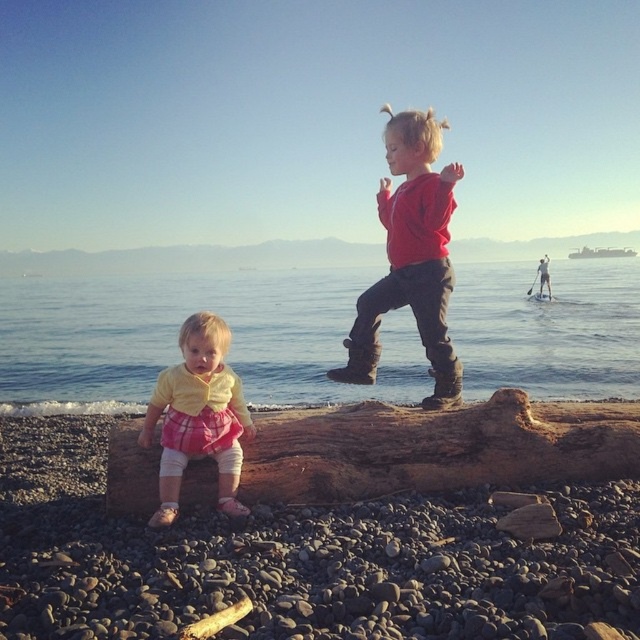
Question: Which of the following is the farthest from the observer?

Choices:
 (A) (538, 269)
 (B) (200, 344)

Answer: (A)

Question: Which object appears closest to the camera in this image?

Choices:
 (A) brown rough wood at center
 (B) smooth blue water at center

Answer: (A)

Question: Can you confirm if smooth brown log at center is smaller than brown rough wood at center?

Choices:
 (A) yes
 (B) no

Answer: (A)

Question: Is yellow cotton shirt at center below red matte surfboard at center?

Choices:
 (A) yes
 (B) no

Answer: (A)

Question: Among these objects, which one is nearest to the camera?

Choices:
 (A) yellow cotton shirt at center
 (B) red matte surfboard at center
 (C) red matte sweater at center

Answer: (A)

Question: From the image, what is the correct spatial relationship of brown rough wood at center in relation to yellow cotton shirt at center?

Choices:
 (A) below
 (B) above

Answer: (A)